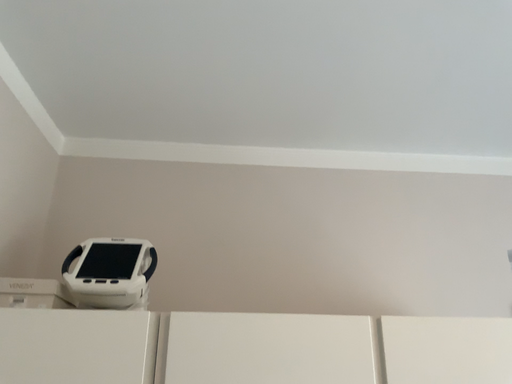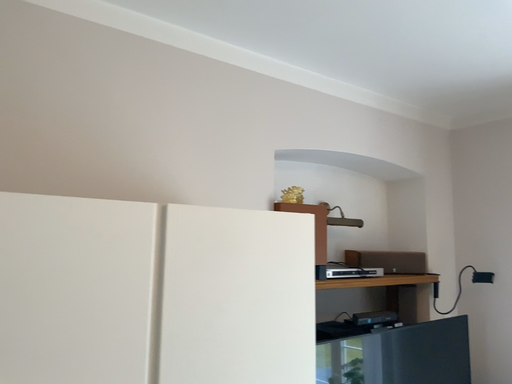
Question: How did the camera likely rotate when shooting the video?

Choices:
 (A) rotated upward
 (B) rotated downward

Answer: (B)